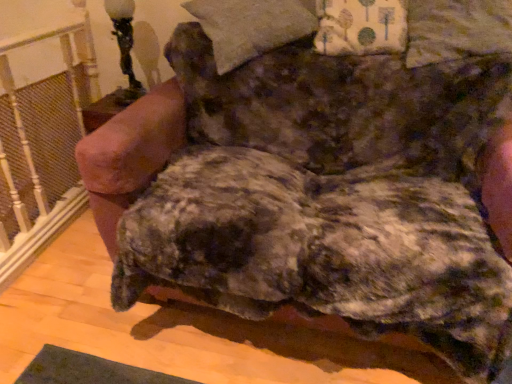
Describe the element at coordinates (456, 29) in the screenshot. I see `floral fabric pillow at upper right, arranged as the 1th pillow when viewed from the right` at that location.

Image resolution: width=512 pixels, height=384 pixels. What are the coordinates of `floral fabric pillow at upper right, arranged as the 1th pillow when viewed from the right` in the screenshot? It's located at (456, 29).

The image size is (512, 384). What do you see at coordinates (331, 197) in the screenshot?
I see `fluffy brown dog at center` at bounding box center [331, 197].

Describe the element at coordinates (42, 144) in the screenshot. I see `white painted wood at left` at that location.

This screenshot has height=384, width=512. Identify the location of floral fabric pillow at upper right, arranged as the 1th pillow when viewed from the right. (456, 29).

From the image's perspective, is fluffy beige pillow at upper center, which is the 2th pillow from right to left, above fluffy brown dog at center?

Yes.

Is fluffy beige pillow at upper center, which is the 2th pillow from right to left, to the left of fluffy brown dog at center from the viewer's perspective?

Yes.

How far apart are fluffy beige pillow at upper center, the first pillow from the left, and fluffy brown dog at center?

They are 16.16 inches apart.

This screenshot has height=384, width=512. I want to click on pillow that is the 2nd one when counting upward from the fluffy brown dog at center (from the image's perspective), so click(251, 26).

From the image's perspective, is white painted wood at left positioned above or below fluffy beige pillow at upper center, the first pillow from the left?

Clearly, from the image's perspective, white painted wood at left is below fluffy beige pillow at upper center, the first pillow from the left.

Is white painted wood at left positioned with its back to fluffy beige pillow at upper center, which is the 2th pillow from right to left?

Absolutely, white painted wood at left is directed away from fluffy beige pillow at upper center, which is the 2th pillow from right to left.

Is white painted wood at left spatially inside fluffy beige pillow at upper center, which is the 2th pillow from right to left, or outside of it?

white painted wood at left is spatially situated outside fluffy beige pillow at upper center, which is the 2th pillow from right to left.

Between white painted wood at left and fluffy beige pillow at upper center, the first pillow from the left, which one has less height?

fluffy beige pillow at upper center, the first pillow from the left, is shorter.

From the image's perspective, does black glass table lamp at upper left appear higher than fluffy beige pillow at upper center, which is the 2th pillow from right to left?

Yes, from the image's perspective, black glass table lamp at upper left is above fluffy beige pillow at upper center, which is the 2th pillow from right to left.

Considering the sizes of objects black glass table lamp at upper left and fluffy beige pillow at upper center, which is the 2th pillow from right to left, in the image provided, who is bigger, black glass table lamp at upper left or fluffy beige pillow at upper center, which is the 2th pillow from right to left,?

With larger size is fluffy beige pillow at upper center, which is the 2th pillow from right to left.

Which object is further away from the camera taking this photo, black glass table lamp at upper left or fluffy beige pillow at upper center, which is the 2th pillow from right to left?

black glass table lamp at upper left.

From a real-world perspective, is black glass table lamp at upper left beneath fluffy beige pillow at upper center, which is the 2th pillow from right to left?

Yes.

From a real-world perspective, is fluffy brown dog at center positioned over white painted wood at left based on gravity?

Yes.

Is fluffy brown dog at center wider than white painted wood at left?

Yes.

Could you tell me if fluffy brown dog at center is facing white painted wood at left?

No, fluffy brown dog at center does not turn towards white painted wood at left.

Considering the relative positions of fluffy brown dog at center and white painted wood at left in the image provided, is fluffy brown dog at center to the left of white painted wood at left from the viewer's perspective?

Incorrect, fluffy brown dog at center is not on the left side of white painted wood at left.

Starting from the white painted wood at left, which pillow is the 2nd one to the right? Please provide its 2D coordinates.

[(456, 29)]

Is floral fabric pillow at upper right, the second pillow when ordered from left to right, facing towards white painted wood at left?

No, floral fabric pillow at upper right, the second pillow when ordered from left to right, is not oriented towards white painted wood at left.

Considering the positions of points (504, 26) and (42, 102), is point (504, 26) closer to camera compared to point (42, 102)?

Yes.

Can we say floral fabric pillow at upper right, the second pillow when ordered from left to right, lies outside white painted wood at left?

That's correct, floral fabric pillow at upper right, the second pillow when ordered from left to right, is outside of white painted wood at left.

Who is taller, floral fabric pillow at upper right, the second pillow when ordered from left to right, or fluffy brown dog at center?

Standing taller between the two is fluffy brown dog at center.

Considering the positions of objects floral fabric pillow at upper right, the second pillow when ordered from left to right, and fluffy brown dog at center in the image provided, who is more to the left, floral fabric pillow at upper right, the second pillow when ordered from left to right, or fluffy brown dog at center?

Positioned to the left is fluffy brown dog at center.

Could you tell me if floral fabric pillow at upper right, arranged as the 1th pillow when viewed from the right, is turned towards fluffy brown dog at center?

No, floral fabric pillow at upper right, arranged as the 1th pillow when viewed from the right, does not turn towards fluffy brown dog at center.

Considering the positions of point (481, 4) and point (424, 91), is point (481, 4) closer or farther from the camera than point (424, 91)?

Clearly, point (481, 4) is closer to the camera than point (424, 91).

Between fluffy brown dog at center and floral fabric pillow at upper right, arranged as the 1th pillow when viewed from the right, which one appears on the left side from the viewer's perspective?

fluffy brown dog at center.

Can you confirm if fluffy brown dog at center is smaller than floral fabric pillow at upper right, the second pillow when ordered from left to right?

No.

I want to click on dog lying on the left of floral fabric pillow at upper right, arranged as the 1th pillow when viewed from the right, so click(x=331, y=197).

Which pillow is the 2nd one when counting from the back of the fluffy brown dog at center? Please provide its 2D coordinates.

[(251, 26)]

This screenshot has height=384, width=512. Identify the location of pillow that is the 1st object to the right of the white painted wood at left, starting at the anchor. (251, 26).

Based on their spatial positions, is white painted wood at left or black glass table lamp at upper left further from fluffy brown dog at center?

black glass table lamp at upper left is further to fluffy brown dog at center.

When comparing their distances from fluffy brown dog at center, does black glass table lamp at upper left or floral fabric pillow at upper right, the second pillow when ordered from left to right, seem closer?

Based on the image, floral fabric pillow at upper right, the second pillow when ordered from left to right, appears to be nearer to fluffy brown dog at center.

When comparing their distances from white painted wood at left, does floral fabric pillow at upper right, the second pillow when ordered from left to right, or fluffy brown dog at center seem further?

Among the two, floral fabric pillow at upper right, the second pillow when ordered from left to right, is located further to white painted wood at left.

Considering their positions, is fluffy brown dog at center positioned closer to fluffy beige pillow at upper center, the first pillow from the left, than floral fabric pillow at upper right, arranged as the 1th pillow when viewed from the right?

The object closer to fluffy beige pillow at upper center, the first pillow from the left, is fluffy brown dog at center.

Looking at the image, which one is located further to black glass table lamp at upper left, fluffy brown dog at center or white painted wood at left?

fluffy brown dog at center.

Estimate the real-world distances between objects in this image. Which object is further from black glass table lamp at upper left, floral fabric pillow at upper right, arranged as the 1th pillow when viewed from the right, or fluffy brown dog at center?

Among the two, floral fabric pillow at upper right, arranged as the 1th pillow when viewed from the right, is located further to black glass table lamp at upper left.

Which object lies further to the anchor point floral fabric pillow at upper right, arranged as the 1th pillow when viewed from the right, fluffy brown dog at center or white painted wood at left?

The object further to floral fabric pillow at upper right, arranged as the 1th pillow when viewed from the right, is white painted wood at left.

Consider the image. Looking at the image, which one is located closer to white painted wood at left, black glass table lamp at upper left or fluffy beige pillow at upper center, which is the 2th pillow from right to left?

Among the two, black glass table lamp at upper left is located nearer to white painted wood at left.

Where is `pillow between white painted wood at left and fluffy brown dog at center in the horizontal direction`? This screenshot has width=512, height=384. pillow between white painted wood at left and fluffy brown dog at center in the horizontal direction is located at coordinates (251, 26).

You are a GUI agent. You are given a task and a screenshot of the screen. Output one action in this format:
    pyautogui.click(x=<x>, y=<y>)
    Task: Click on the pillow between black glass table lamp at upper left and floral fabric pillow at upper right, the second pillow when ordered from left to right
    The width and height of the screenshot is (512, 384).
    Given the screenshot: What is the action you would take?
    pyautogui.click(x=251, y=26)

Identify the location of dog between white painted wood at left and floral fabric pillow at upper right, arranged as the 1th pillow when viewed from the right. The height and width of the screenshot is (384, 512). (331, 197).

Image resolution: width=512 pixels, height=384 pixels. I want to click on table lamp between white painted wood at left and floral fabric pillow at upper right, arranged as the 1th pillow when viewed from the right, from left to right, so click(124, 48).